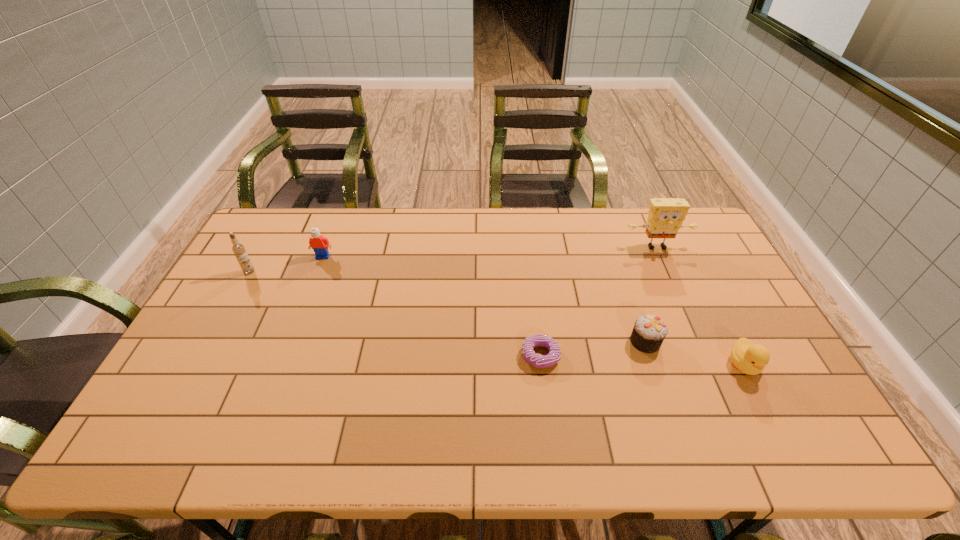
Find the location of a particular element. The width and height of the screenshot is (960, 540). free space located on the label of the vodka is located at coordinates (241, 286).

Where is `vacant area situated on the face of the fourth shortest object`? This screenshot has width=960, height=540. vacant area situated on the face of the fourth shortest object is located at coordinates (305, 301).

The image size is (960, 540). Find the location of `free space located on the front-facing side of the duck`. free space located on the front-facing side of the duck is located at coordinates (789, 454).

Identify the location of vacant space located on the left of the cupcake. The height and width of the screenshot is (540, 960). pyautogui.click(x=584, y=342).

The height and width of the screenshot is (540, 960). Identify the location of vacant space situated on the left of the shortest object. (400, 356).

Where is `object positioned at the far edge`? The height and width of the screenshot is (540, 960). object positioned at the far edge is located at coordinates (665, 216).

I want to click on object located in the left edge section of the desktop, so click(x=238, y=249).

This screenshot has height=540, width=960. I want to click on sponge positioned at the right edge, so click(x=665, y=216).

Find the location of a particular element. This screenshot has height=540, width=960. duck that is positioned at the right edge is located at coordinates (748, 358).

This screenshot has height=540, width=960. I want to click on object situated at the far right corner, so click(665, 216).